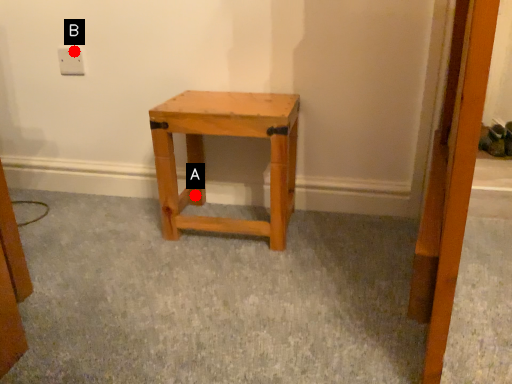
Question: Two points are circled on the image, labeled by A and B beside each circle. Which of the following is the farthest from the observer?

Choices:
 (A) A is further
 (B) B is further

Answer: (A)